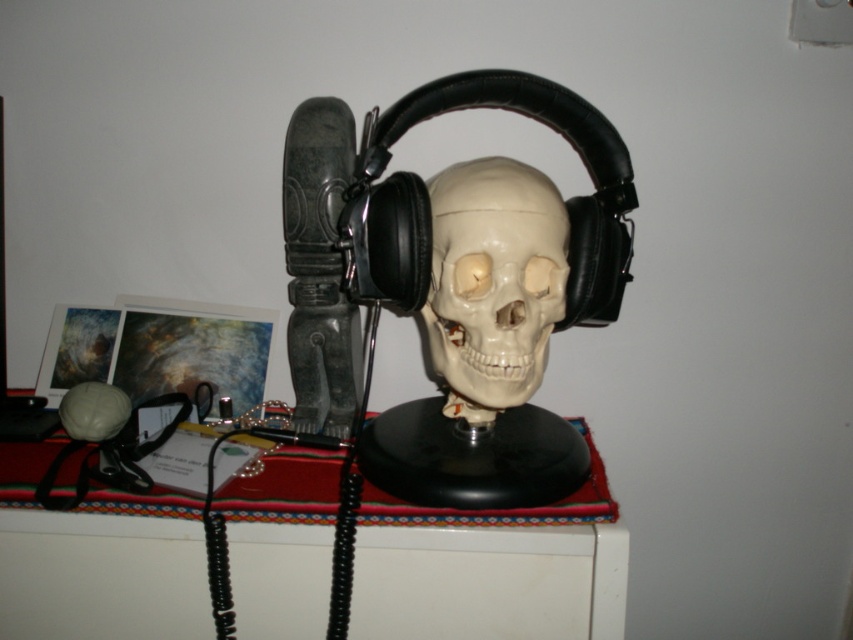
Question: Among these points, which one is nearest to the camera?

Choices:
 (A) (546, 296)
 (B) (310, 609)

Answer: (B)

Question: Which point is closer to the camera taking this photo?

Choices:
 (A) (148, 620)
 (B) (466, 328)

Answer: (A)

Question: Is white glossy table at center in front of white matte skull at center?

Choices:
 (A) yes
 (B) no

Answer: (A)

Question: Considering the relative positions of white glossy table at center and white matte skull at center in the image provided, where is white glossy table at center located with respect to white matte skull at center?

Choices:
 (A) below
 (B) above

Answer: (A)

Question: Does white glossy table at center have a smaller size compared to white matte skull at center?

Choices:
 (A) yes
 (B) no

Answer: (B)